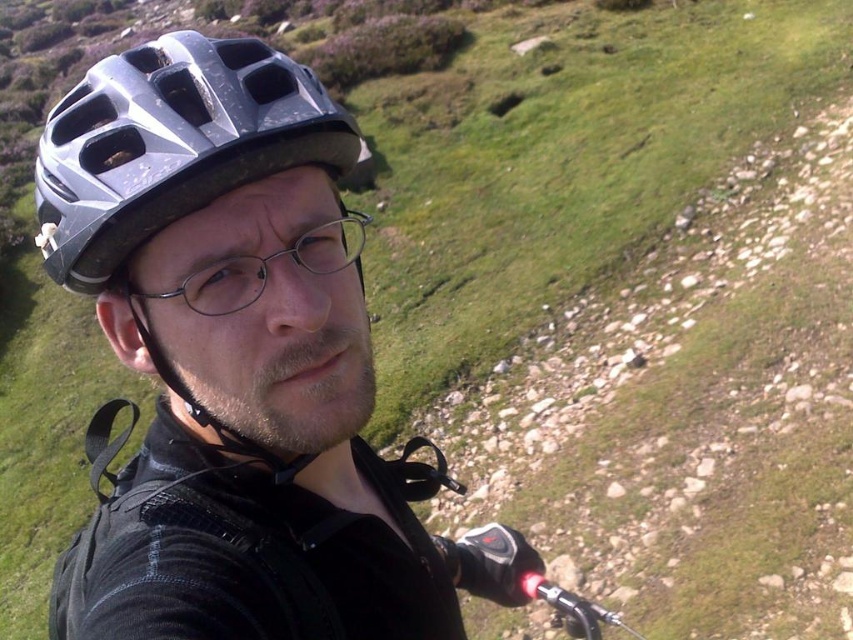
Is metallic helmet at center below clear plastic glasses at center?

Yes, metallic helmet at center is below clear plastic glasses at center.

Who is shorter, metallic helmet at center or clear plastic glasses at center?

clear plastic glasses at center

Does point (90, 604) lie in front of point (254, 285)?

No.

At what (x,y) coordinates should I click in order to perform the action: click on metallic helmet at center. Please return your answer as a coordinate pair (x, y). The image size is (853, 640). Looking at the image, I should click on (238, 365).

In the scene shown: Does metallic helmet at center have a greater height compared to metallic silver helmet at upper left?

Indeed, metallic helmet at center has a greater height compared to metallic silver helmet at upper left.

Consider the image. Can you confirm if metallic helmet at center is positioned below metallic silver helmet at upper left?

Yes.

Is point (164, 451) farther from viewer compared to point (273, 67)?

Yes, it is behind point (273, 67).

Identify the location of metallic helmet at center. The image size is (853, 640). (238, 365).

Is metallic silver helmet at upper left positioned before clear plastic glasses at center?

That is True.

Does metallic silver helmet at upper left have a greater width compared to clear plastic glasses at center?

Yes, metallic silver helmet at upper left is wider than clear plastic glasses at center.

The width and height of the screenshot is (853, 640). I want to click on metallic silver helmet at upper left, so click(x=172, y=145).

The height and width of the screenshot is (640, 853). What are the coordinates of `metallic silver helmet at upper left` in the screenshot? It's located at (172, 145).